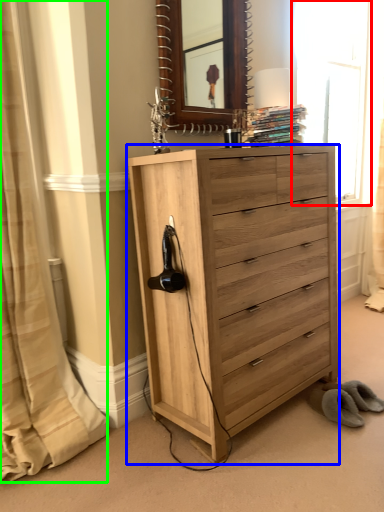
Question: Estimate the real-world distances between objects in this image. Which object is closer to window (highlighted by a red box), chest of drawers (highlighted by a blue box) or curtain (highlighted by a green box)?

Choices:
 (A) chest of drawers
 (B) curtain

Answer: (A)